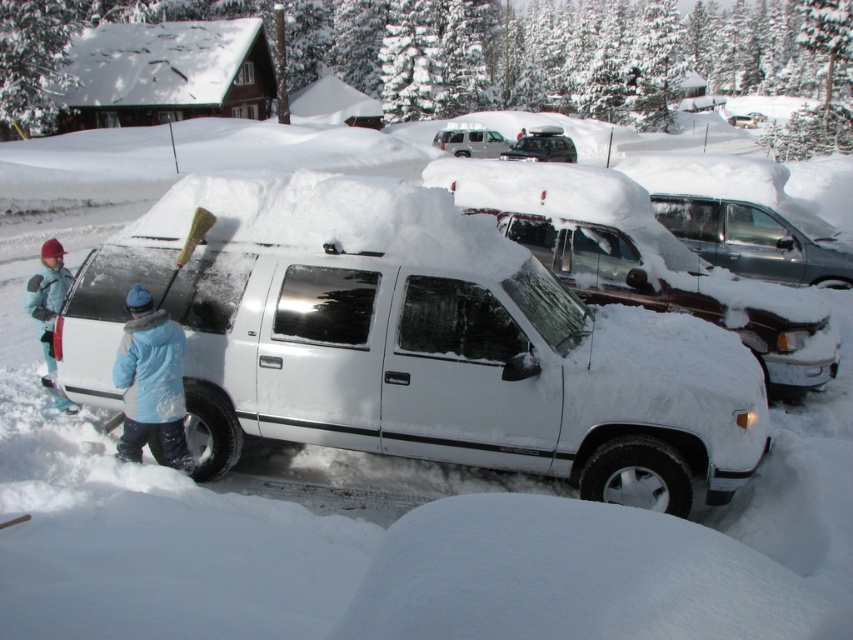
Is light blue jacket at left positioned in front of matte black suv at center?

Yes.

Does light blue jacket at left appear on the left side of matte black suv at center?

Yes, light blue jacket at left is to the left of matte black suv at center.

I want to click on light blue jacket at left, so click(x=47, y=294).

Who is more forward, (x=38, y=320) or (x=460, y=141)?

Positioned in front is point (x=38, y=320).

Who is higher up, light blue jacket at left or silver metallic suv at upper center?

silver metallic suv at upper center is higher up.

Who is more distant from viewer, (47, 284) or (495, 148)?

Point (495, 148)

Where is `light blue jacket at left`? The width and height of the screenshot is (853, 640). light blue jacket at left is located at coordinates (47, 294).

Is point (664, 198) farther from viewer compared to point (523, 138)?

No.

Is metallic gray minivan at center bigger than matte black suv at center?

Correct, metallic gray minivan at center is larger in size than matte black suv at center.

Where is `metallic gray minivan at center`? metallic gray minivan at center is located at coordinates (753, 241).